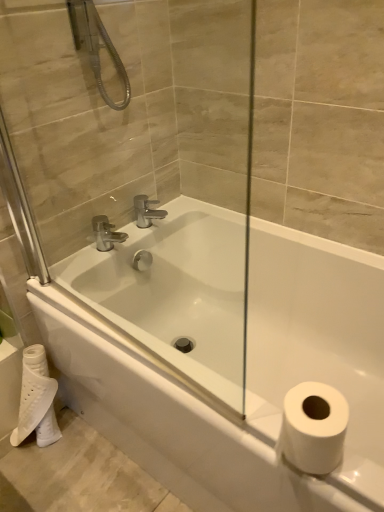
Question: Should I look upward or downward to see transparent glass door at center?

Choices:
 (A) up
 (B) down

Answer: (A)

Question: Considering the relative sizes of white matte toilet paper at lower left and white glossy bathtub at center in the image provided, is white matte toilet paper at lower left shorter than white glossy bathtub at center?

Choices:
 (A) no
 (B) yes

Answer: (B)

Question: Is white glossy bathtub at center at the back of white matte toilet paper at lower left?

Choices:
 (A) no
 (B) yes

Answer: (A)

Question: From a real-world perspective, is white matte toilet paper at lower left on top of white glossy bathtub at center?

Choices:
 (A) no
 (B) yes

Answer: (A)

Question: Can you confirm if white matte toilet paper at lower left is wider than white glossy bathtub at center?

Choices:
 (A) yes
 (B) no

Answer: (B)

Question: Would you say white matte toilet paper at lower left is a long distance from white glossy bathtub at center?

Choices:
 (A) yes
 (B) no

Answer: (B)

Question: Is white matte toilet paper at lower left beside white glossy bathtub at center?

Choices:
 (A) no
 (B) yes

Answer: (A)

Question: From the image's perspective, is white matte toilet paper at lower left located beneath transparent glass door at center?

Choices:
 (A) yes
 (B) no

Answer: (A)

Question: Does white matte toilet paper at lower left have a smaller size compared to transparent glass door at center?

Choices:
 (A) no
 (B) yes

Answer: (B)

Question: Is white matte toilet paper at lower left thinner than transparent glass door at center?

Choices:
 (A) yes
 (B) no

Answer: (B)

Question: Is white matte toilet paper at lower left bigger than transparent glass door at center?

Choices:
 (A) no
 (B) yes

Answer: (A)

Question: Considering the relative positions of white matte toilet paper at lower left and transparent glass door at center in the image provided, is white matte toilet paper at lower left to the left of transparent glass door at center from the viewer's perspective?

Choices:
 (A) no
 (B) yes

Answer: (B)

Question: From the image's perspective, does white matte toilet paper at lower left appear higher than transparent glass door at center?

Choices:
 (A) yes
 (B) no

Answer: (B)

Question: Is polished chrome faucet at upper center oriented away from transparent glass door at center?

Choices:
 (A) no
 (B) yes

Answer: (A)